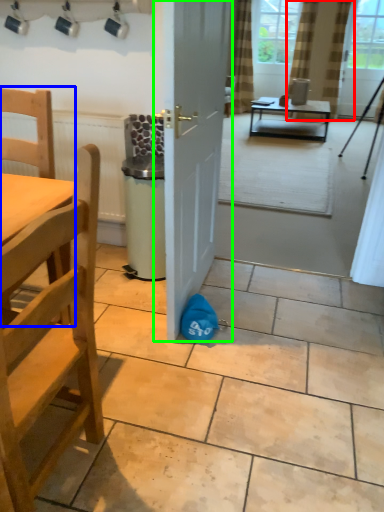
Question: Which object is positioned closest to curtain (highlighted by a red box)? Select from chair (highlighted by a blue box) and door (highlighted by a green box).

Choices:
 (A) chair
 (B) door

Answer: (B)